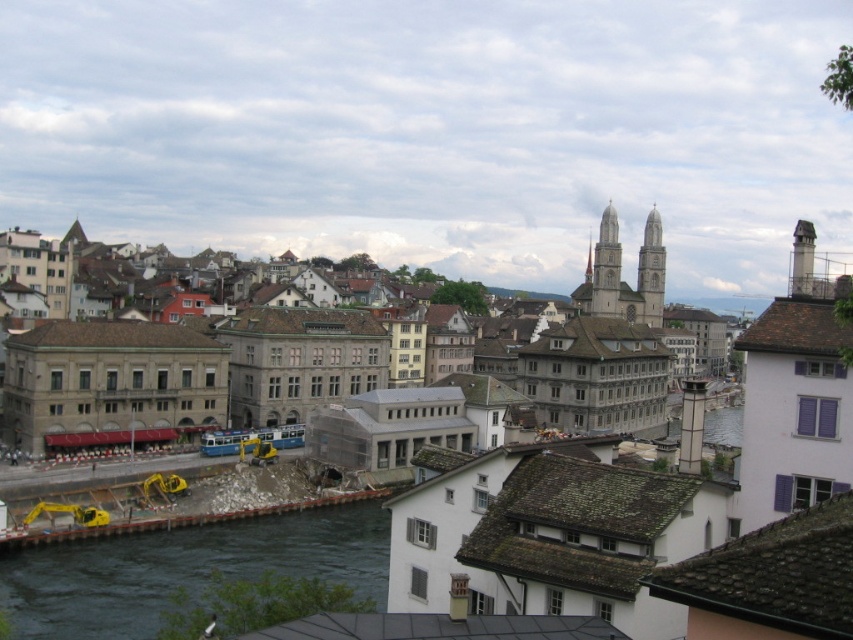
You are a delivery driver who needs to park your truck between the matte gray building at center and the dark blue water at lower left. Can you fit your truck there if it is 3 meters wide?

The matte gray building at center might be wider than dark blue water at lower left, but since the exact width isn not provided, it is uncertain whether the space between them can accommodate a 3 meter wide truck.

You are a city planner reviewing this area. You need to determine if the matte gray building at center can be seen from the dark blue water at lower left. Based on their heights, can the building be visible from the water?

The matte gray building at center is taller than dark blue water at lower left, so yes, the building can be seen from the water since it is elevated higher than the water level.